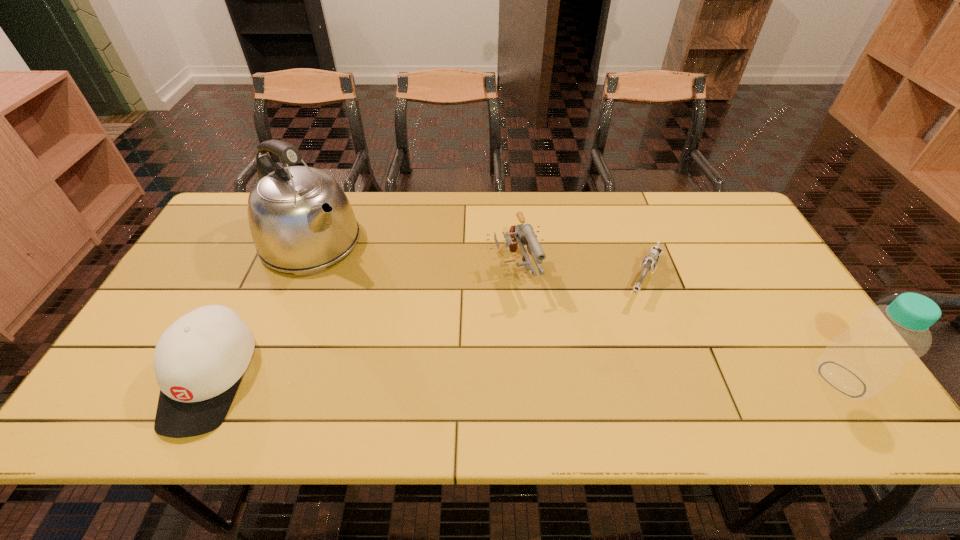
Image resolution: width=960 pixels, height=540 pixels. In the image, there is a desktop. Find the location of `vacant space at the far right corner`. vacant space at the far right corner is located at coordinates (726, 232).

The image size is (960, 540). Find the location of `vacant region between the kettle and the bottle`. vacant region between the kettle and the bottle is located at coordinates (577, 310).

Image resolution: width=960 pixels, height=540 pixels. What are the coordinates of `vacant space in between the second shortest object and the third object from left to right` in the screenshot? It's located at (362, 326).

Find the location of a particular element. This screenshot has height=540, width=960. vacant area that lies between the baseball cap and the rightmost object is located at coordinates click(526, 379).

In order to click on vacant space that is in between the third object from left to right and the fourth tallest object in this screenshot , I will do `click(362, 326)`.

Locate an element on the screen. Image resolution: width=960 pixels, height=540 pixels. free point between the fourth object from left to right and the kettle is located at coordinates (478, 260).

Locate an element on the screen. The image size is (960, 540). empty space that is in between the kettle and the baseball cap is located at coordinates (260, 310).

Image resolution: width=960 pixels, height=540 pixels. What are the coordinates of `blank region between the rightmost object and the second shortest object` in the screenshot? It's located at (526, 379).

This screenshot has height=540, width=960. I want to click on blank region between the fourth shortest object and the second shortest object, so click(526, 379).

Identify the location of empty space between the right gun and the third object from right to left. The image size is (960, 540). (579, 275).